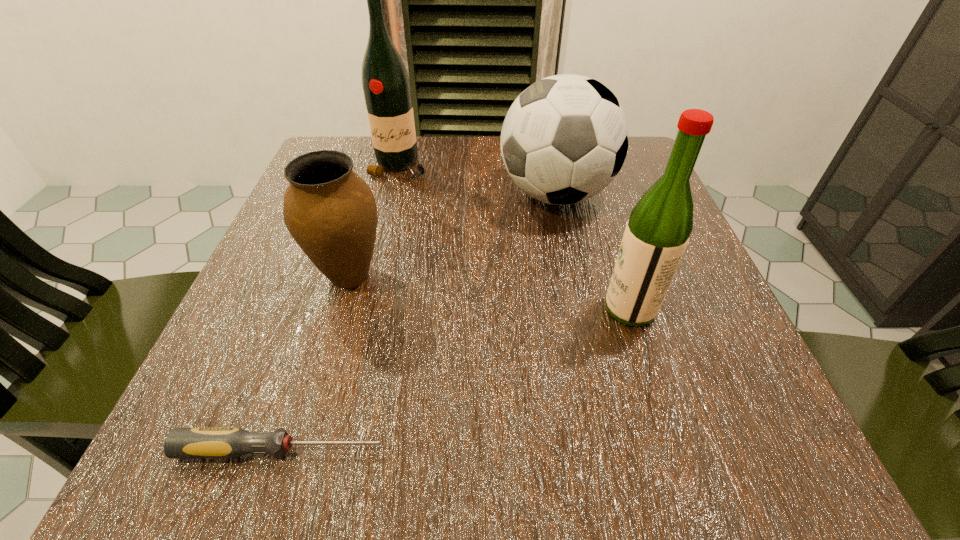
Where is `free space at the far right corner of the desktop`? free space at the far right corner of the desktop is located at coordinates (616, 186).

Find the location of a particular element. This screenshot has height=540, width=960. vacant position at the near right corner of the desktop is located at coordinates (772, 444).

The width and height of the screenshot is (960, 540). I want to click on vacant space in between the wine bottle and the soccer ball, so click(477, 180).

Find the location of a particular element. The width and height of the screenshot is (960, 540). vacant area between the urn and the soccer ball is located at coordinates (453, 235).

The height and width of the screenshot is (540, 960). What are the coordinates of `unoccupied area between the shortest object and the wine bottle` in the screenshot? It's located at (340, 308).

I want to click on blank region between the soccer ball and the wine bottle, so click(x=477, y=180).

At what (x,y) coordinates should I click in order to perform the action: click on free point between the liquor and the urn. Please return your answer as a coordinate pair (x, y). Looking at the image, I should click on pos(490,292).

Find the location of `vacant space that is in between the liquor and the wine bottle`. vacant space that is in between the liquor and the wine bottle is located at coordinates (515, 238).

Locate an element on the screen. The image size is (960, 540). vacant point located between the soccer ball and the liquor is located at coordinates (593, 252).

Locate an element on the screen. The height and width of the screenshot is (540, 960). blank region between the urn and the liquor is located at coordinates (490, 292).